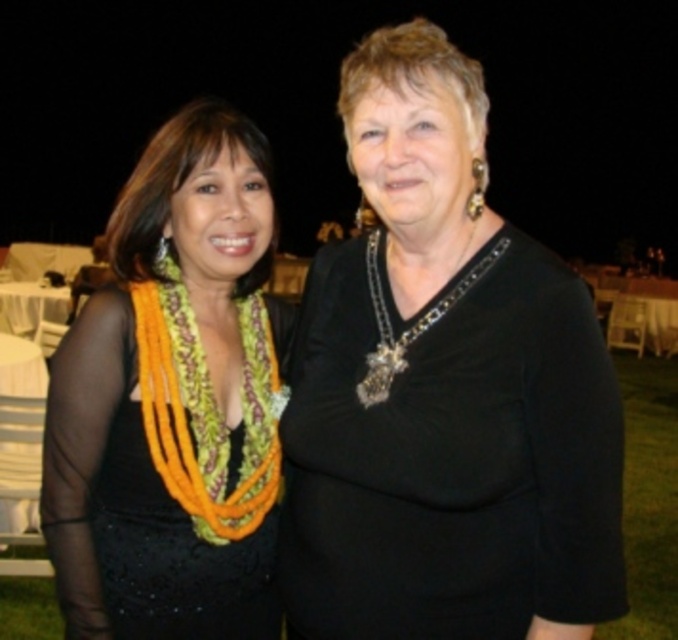
Question: Which of the following is the closest to the observer?

Choices:
 (A) black matte dress at left
 (B) silver metallic chain at center
 (C) black velvet dress at center
 (D) multicolored woven lei at center

Answer: (C)

Question: Can you confirm if black velvet dress at center is wider than black matte dress at left?

Choices:
 (A) yes
 (B) no

Answer: (A)

Question: Can you confirm if black matte dress at left is bigger than silver metallic chain at center?

Choices:
 (A) no
 (B) yes

Answer: (B)

Question: Can you confirm if black matte dress at left is smaller than silver metallic chain at center?

Choices:
 (A) yes
 (B) no

Answer: (B)

Question: Which of these objects is positioned closest to the black matte dress at left?

Choices:
 (A) multicolored woven lei at center
 (B) silver metallic chain at center

Answer: (A)

Question: Which point appears farthest from the camera in this image?

Choices:
 (A) (268, 476)
 (B) (388, 374)
 (C) (92, 371)
 (D) (523, 560)

Answer: (A)